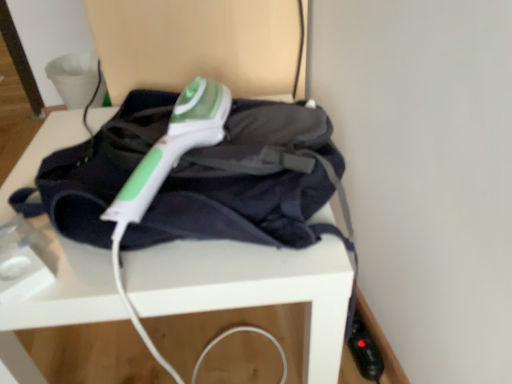
Identify the location of white plastic table at center. (250, 288).

What do you see at coordinates (250, 288) in the screenshot? This screenshot has width=512, height=384. I see `white plastic table at center` at bounding box center [250, 288].

I want to click on white plastic table at center, so click(250, 288).